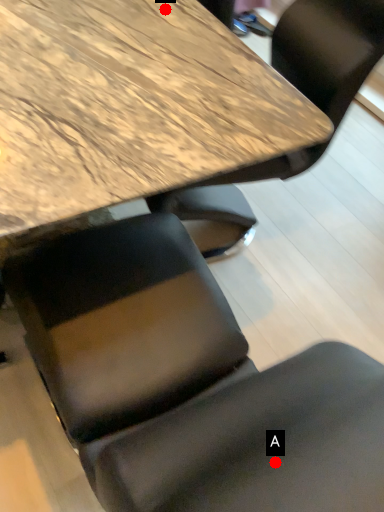
Question: Two points are circled on the image, labeled by A and B beside each circle. Which point is closer to the camera?

Choices:
 (A) A is closer
 (B) B is closer

Answer: (A)